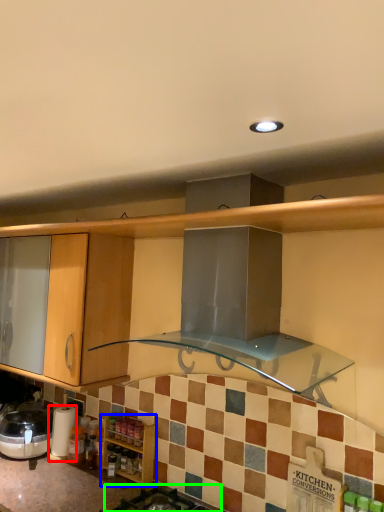
Question: Considering the real-world distances, which object is closest to appliance (highlighted by a red box)? cabinetry (highlighted by a blue box) or gas stove (highlighted by a green box).

Choices:
 (A) cabinetry
 (B) gas stove

Answer: (A)